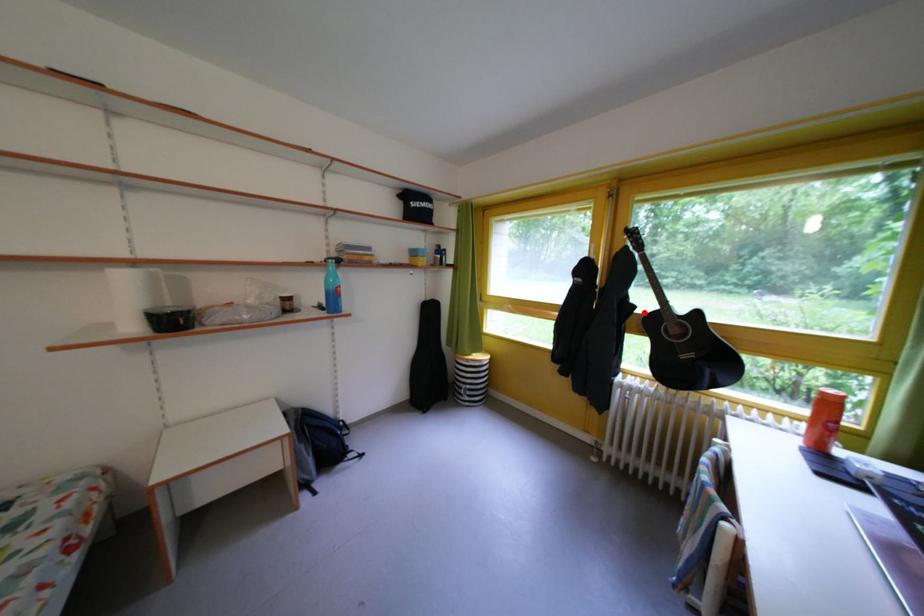
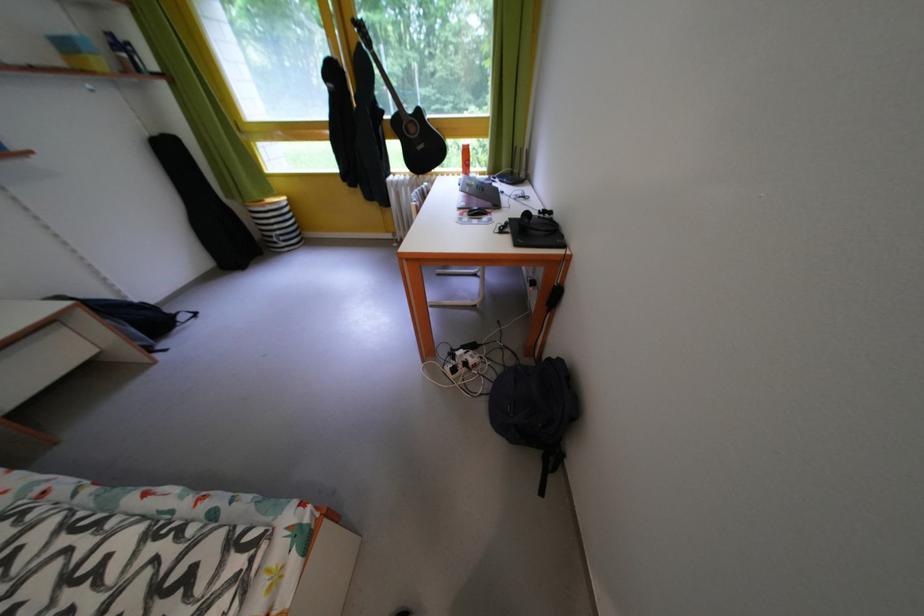
In the second image, find the point that corresponds to the highlighted location in the first image.

(393, 118)